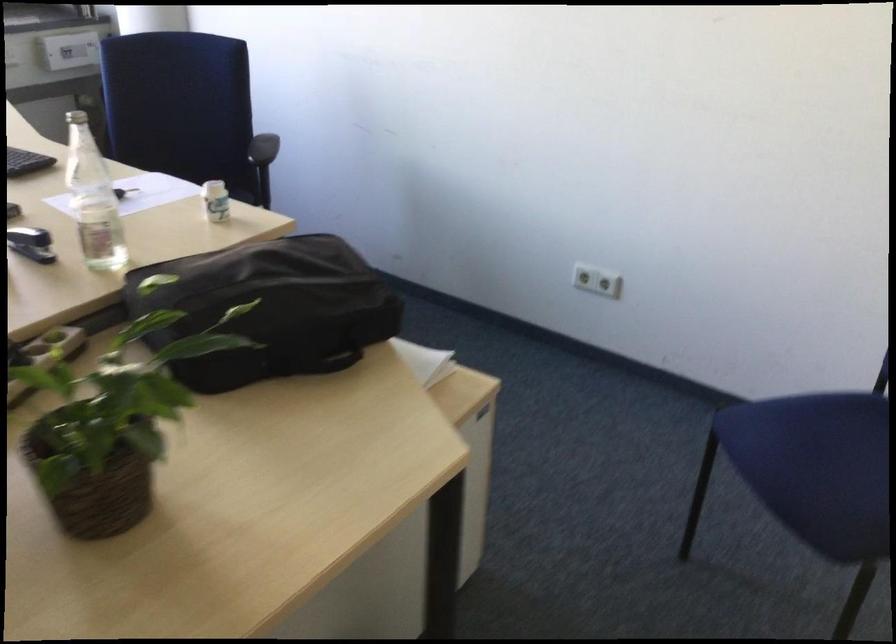
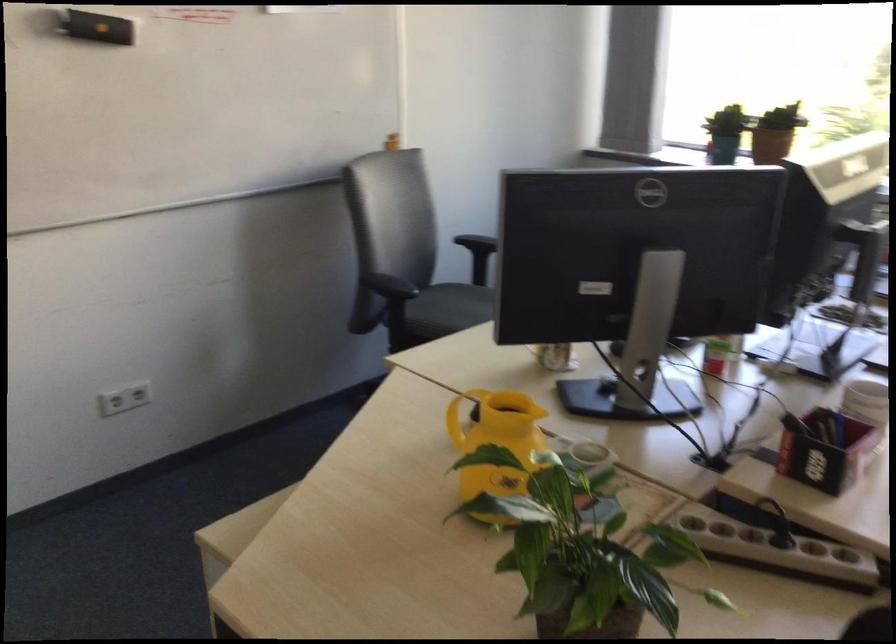
The images are taken continuously from a first-person perspective. In which direction is your viewpoint rotating?

The camera's rotation is toward left-down.